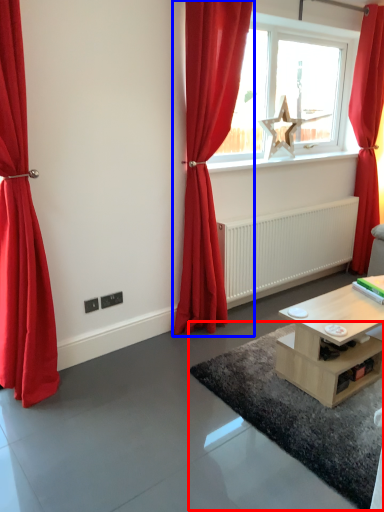
Question: Which object is closer to the camera taking this photo, plain (highlighted by a red box) or curtain (highlighted by a blue box)?

Choices:
 (A) plain
 (B) curtain

Answer: (A)